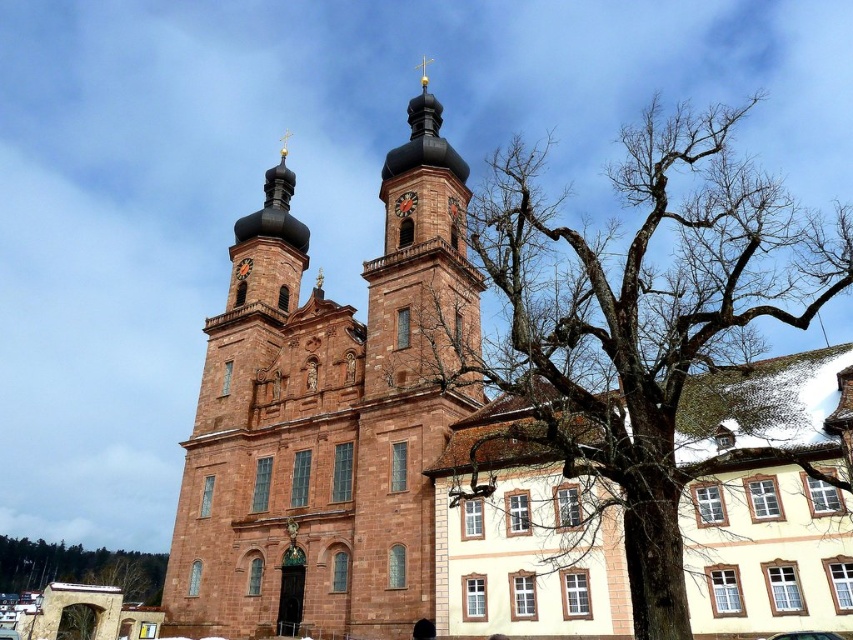
Question: Which point is closer to the camera?

Choices:
 (A) (155, 602)
 (B) (397, 209)
 (C) (427, 228)
 (D) (641, 636)

Answer: (D)

Question: Is matte reddish-brown church tower at center wider than brown stone tower at center?

Choices:
 (A) no
 (B) yes

Answer: (B)

Question: Does brown stone tower at center appear over bare branches at lower left?

Choices:
 (A) no
 (B) yes

Answer: (B)

Question: Is matte reddish-brown church tower at center wider than brown stone tower at center?

Choices:
 (A) no
 (B) yes

Answer: (B)

Question: Estimate the real-world distances between objects in this image. Which object is closer to the bare branches at center?

Choices:
 (A) dark brown wooden clock at upper center
 (B) brown stone tower at center

Answer: (B)

Question: Which of these objects is positioned closest to the bare branches at lower left?

Choices:
 (A) dark brown wooden clock at upper center
 (B) matte reddish-brown church tower at center

Answer: (B)